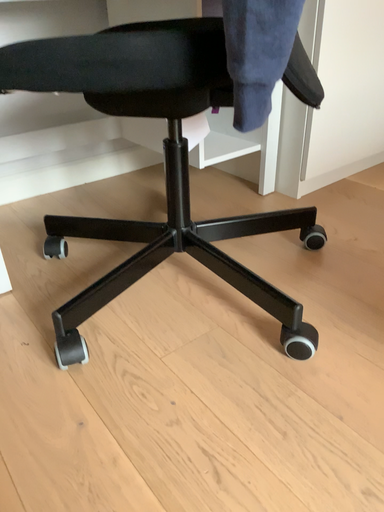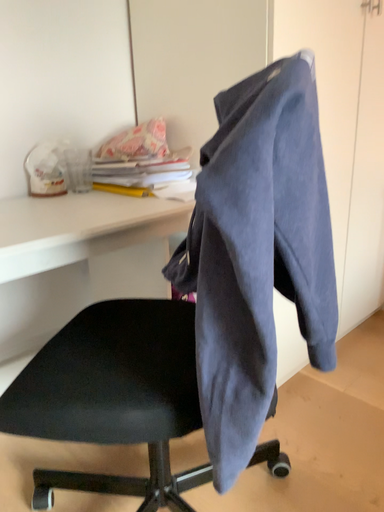
Question: How did the camera likely rotate when shooting the video?

Choices:
 (A) rotated downward
 (B) rotated upward

Answer: (B)